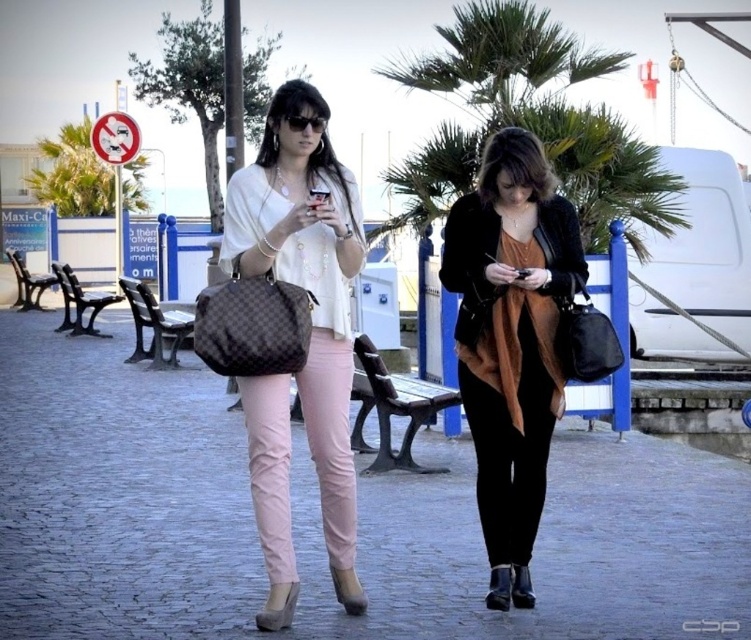
In the scene shown: How distant is green leafy palm tree at upper center from green leafy palm tree at upper left?

11.63 meters

Measure the distance between green leafy palm tree at upper center and camera.

They are 10.29 meters apart.

Find the location of a particular element. The image size is (751, 640). green leafy palm tree at upper center is located at coordinates (502, 61).

Is matte pink pants at center bigger than black glossy smartphone at center?

Correct, matte pink pants at center is larger in size than black glossy smartphone at center.

Is matte pink pants at center smaller than black glossy smartphone at center?

Incorrect, matte pink pants at center is not smaller in size than black glossy smartphone at center.

Who is more forward, (374, 522) or (514, 276)?

Positioned in front is point (514, 276).

You are a GUI agent. You are given a task and a screenshot of the screen. Output one action in this format:
    pyautogui.click(x=<x>, y=<y>)
    Task: Click on the matte pink pants at center
    This screenshot has width=751, height=640.
    Given the screenshot: What is the action you would take?
    pyautogui.click(x=318, y=518)

Does point (234, 252) lie in front of point (65, 195)?

Yes, point (234, 252) is closer to viewer.

This screenshot has height=640, width=751. What do you see at coordinates (308, 289) in the screenshot?
I see `matte black handbag at center` at bounding box center [308, 289].

Identify the location of matte black handbag at center. (308, 289).